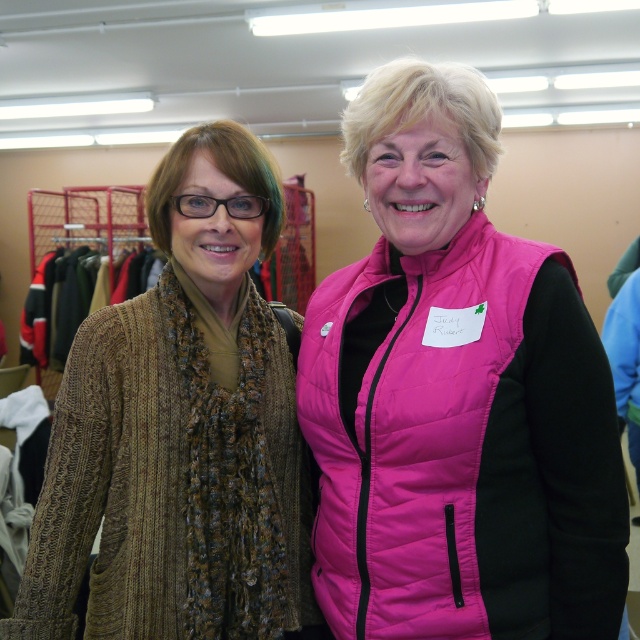
Question: Does pink quilted vest at center appear on the left side of knitted brown scarf at left?

Choices:
 (A) yes
 (B) no

Answer: (B)

Question: Can you confirm if pink quilted vest at center is bigger than knitted brown scarf at left?

Choices:
 (A) yes
 (B) no

Answer: (A)

Question: Is pink quilted vest at center bigger than knitted brown scarf at left?

Choices:
 (A) no
 (B) yes

Answer: (B)

Question: Which point is closer to the camera?

Choices:
 (A) knitted brown scarf at left
 (B) pink quilted vest at center

Answer: (B)

Question: Which of the following is the closest to the observer?

Choices:
 (A) pink quilted vest at center
 (B) knitted brown scarf at left

Answer: (A)